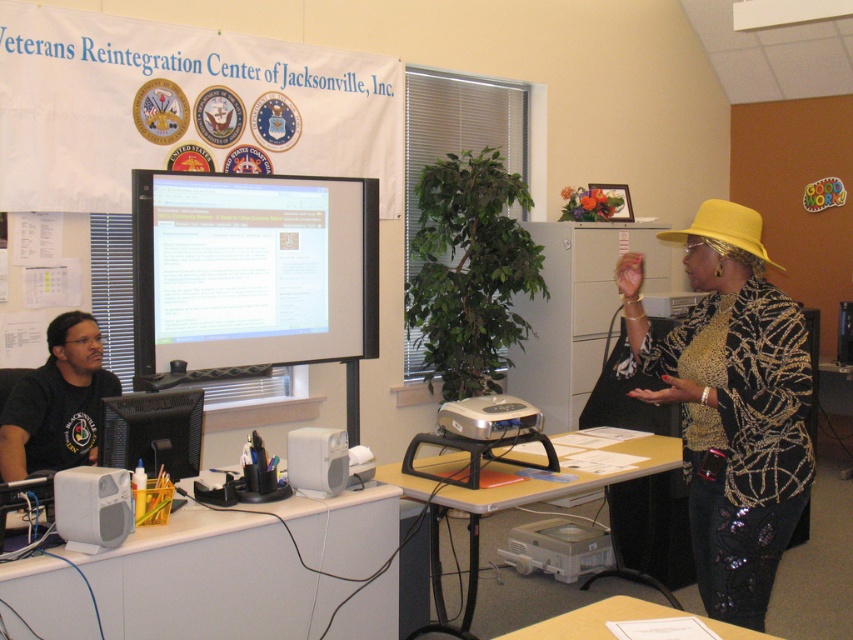
Question: Is light brown wooden table at center further to the viewer compared to yellow fabric hat at upper right?

Choices:
 (A) no
 (B) yes

Answer: (B)

Question: Can you confirm if matte black monitor at center is wider than yellow fabric hat at upper right?

Choices:
 (A) no
 (B) yes

Answer: (B)

Question: Which of these objects is positioned closest to the yellow fabric hat at upper right?

Choices:
 (A) white plastic table at lower left
 (B) matte black monitor at left

Answer: (A)

Question: Is black matte shirt at left bigger than wooden table at lower center?

Choices:
 (A) yes
 (B) no

Answer: (A)

Question: Which of the following is the farthest from the observer?

Choices:
 (A) matte black monitor at center
 (B) white plastic table at lower left
 (C) sequined fabric jacket at center right

Answer: (A)

Question: Which point is closer to the camera taking this photo?

Choices:
 (A) (157, 196)
 (B) (438, 563)
 (C) (103, 406)

Answer: (C)